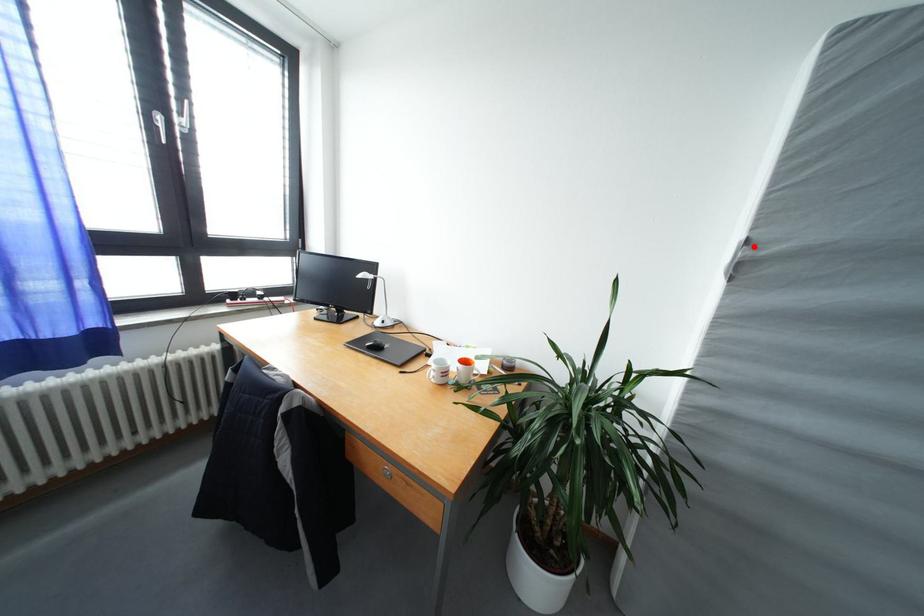
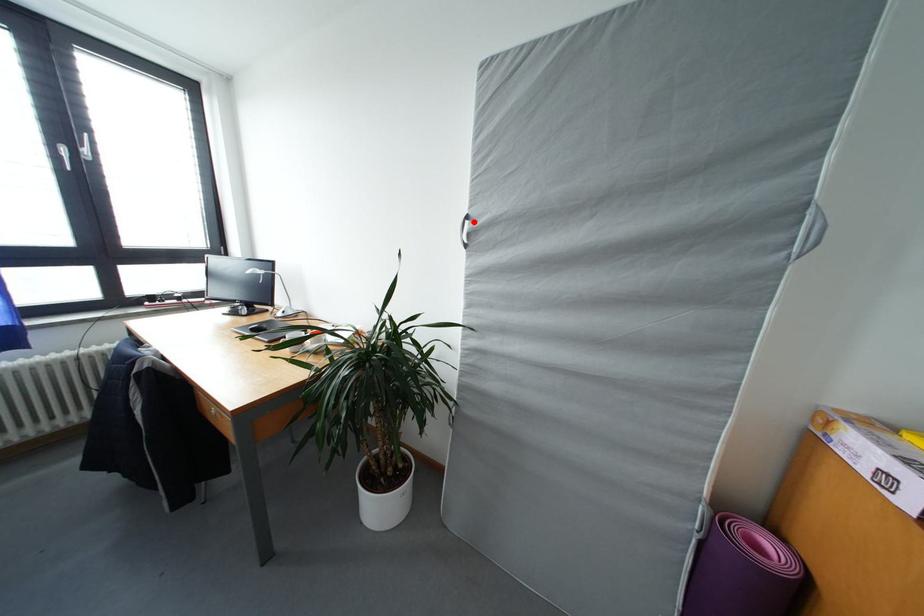
I am providing you with two images of the same scene from different viewpoints. A red point is marked on the first image and another point is marked on the second image. Is the marked point in image1 the same physical position as the marked point in image2?

Yes